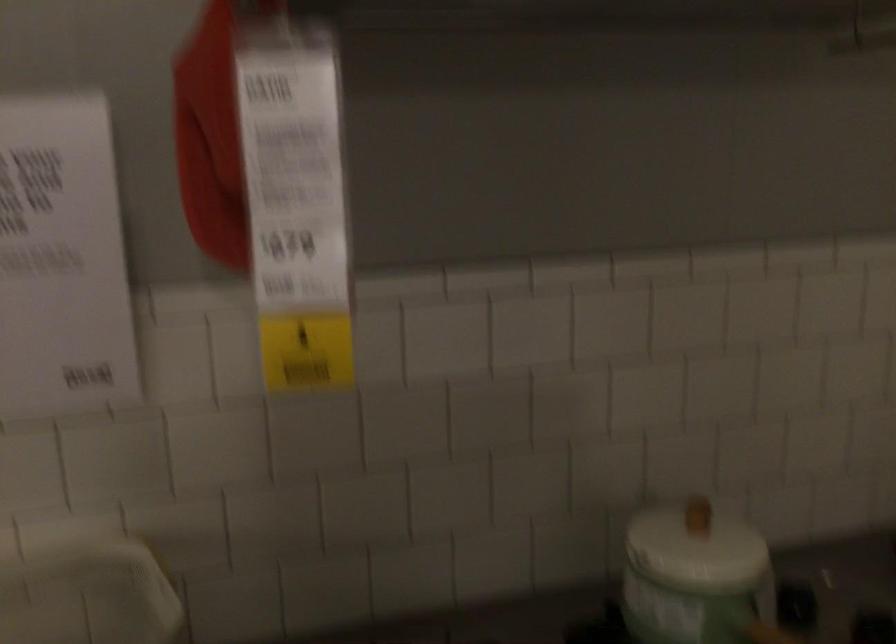
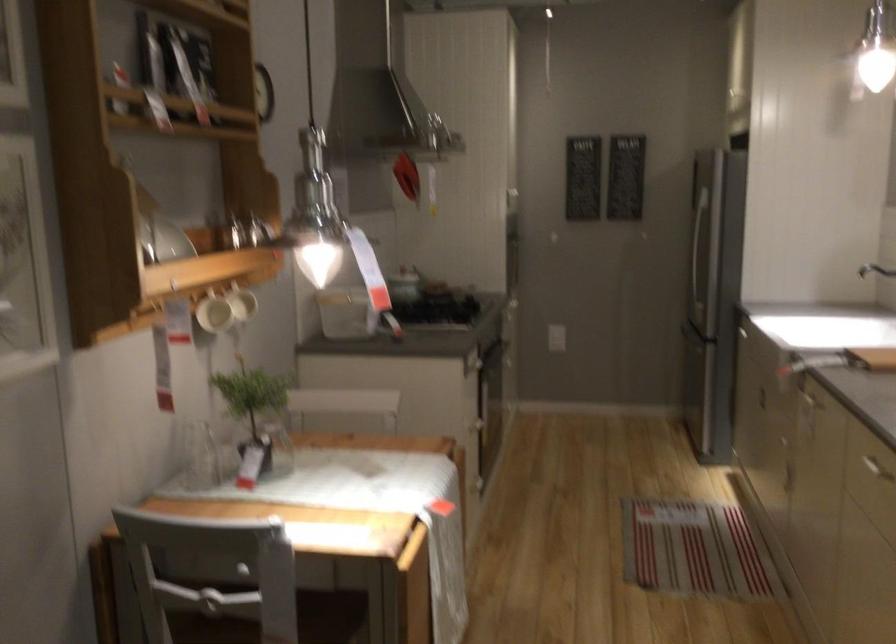
Question: I am providing you with two images of the same scene from different viewpoints. Which of the following objects are not visible in image2?

Choices:
 (A) small lid knob
 (B) oven door handle
 (C) white mug handle
 (D) blue metal handle

Answer: (A)